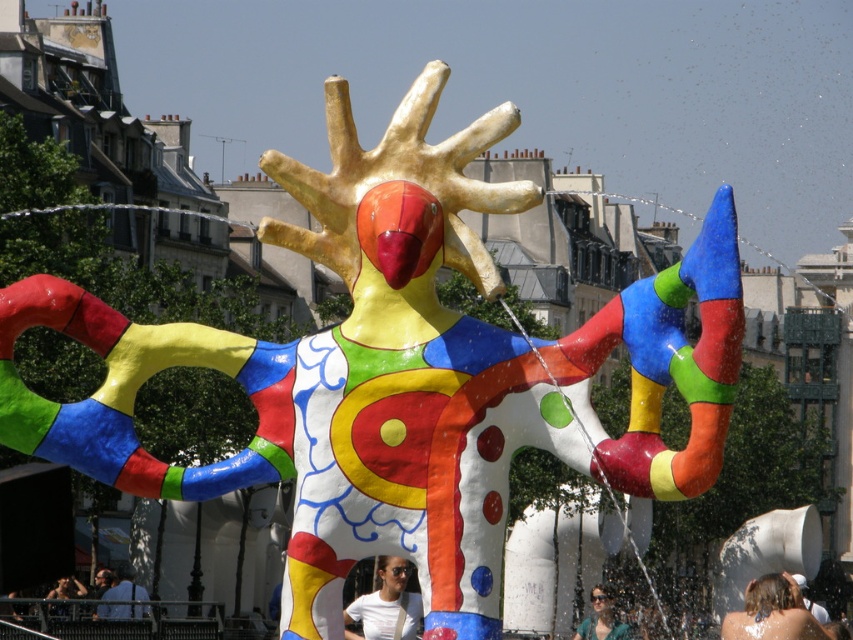
You are a photographer trying to capture both the blonde hair at center and the denim jacket at lower left in a single frame. Based on their sizes, which object should you focus on first to ensure both fit in the shot?

The blonde hair at center is bigger than the denim jacket at lower left, so you should focus on capturing the larger blonde hair at center first to ensure both fit in the frame.